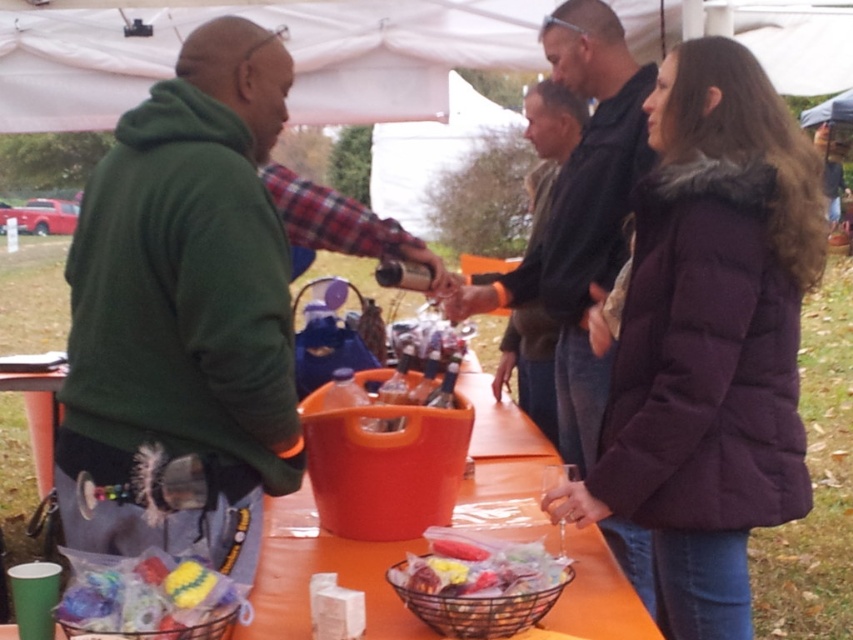
You are helping to organize the outdoor event and need to stack the green fleece jacket at left and the purple puffy coat at center on a rack. Which one should you place on the lower shelf to ensure stability?

The green fleece jacket at left should be placed on the lower shelf because it has a lesser height compared to the purple puffy coat at center, ensuring stability by placing the shorter item at the bottom.

You are organizing an outdoor event and need to place a dark gray sweater at center and a metallic wire basket at lower center on a table. The table is 1.5 meters long. Can both items fit on the table without overlapping?

The dark gray sweater at center is 1.18 meters from the metallic wire basket at lower center. Since the table is 1.5 meters long, and the distance between them is less than the table length, both items can fit on the table without overlapping.